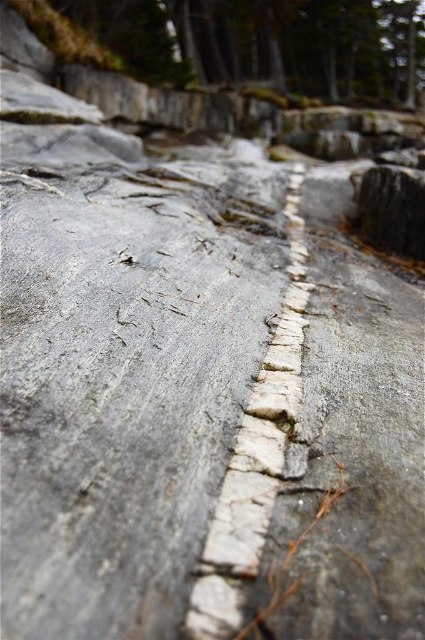
Between point (161, 22) and point (258, 563), which one is positioned in front?

Point (258, 563) is more forward.

What do you see at coordinates (268, 42) in the screenshot? The width and height of the screenshot is (425, 640). I see `smooth gray rock at upper center` at bounding box center [268, 42].

Locate an element on the screen. smooth gray rock at upper center is located at coordinates (268, 42).